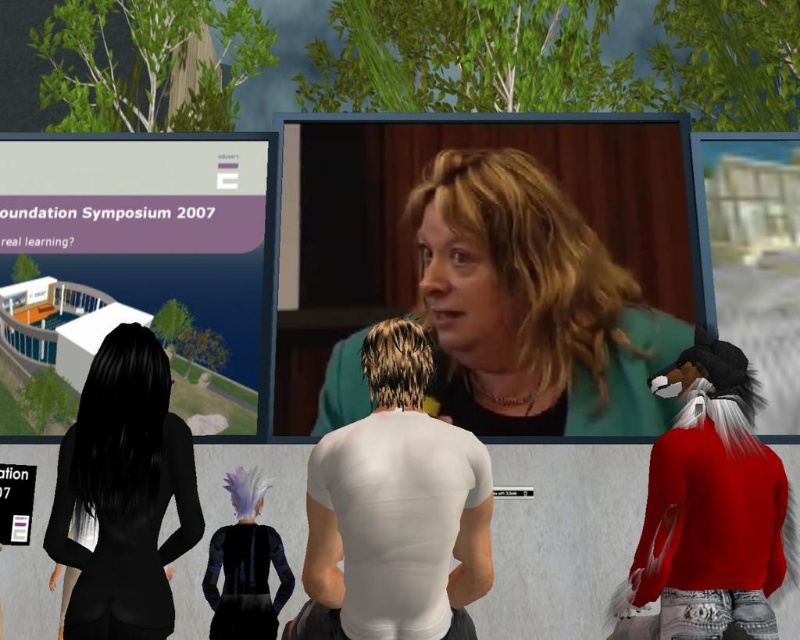
Question: Is white matte shirt at center positioned at the back of red fuzzy sweater at lower right?

Choices:
 (A) no
 (B) yes

Answer: (A)

Question: Observing the image, what is the correct spatial positioning of red fuzzy sweater at lower right in reference to black matte suit at lower left?

Choices:
 (A) right
 (B) left

Answer: (A)

Question: Considering the real-world distances, which object is closest to the red fuzzy sweater at lower right?

Choices:
 (A) black matte suit at lower left
 (B) white matte shirt at center

Answer: (B)

Question: Which point is farther to the camera?

Choices:
 (A) teal fabric jacket at center
 (B) black matte suit at lower left
 (C) matte purple sign at upper left
 (D) red fuzzy sweater at lower right

Answer: (A)

Question: Is matte purple sign at upper left wider than teal fabric jacket at center?

Choices:
 (A) yes
 (B) no

Answer: (A)

Question: Estimate the real-world distances between objects in this image. Which object is farther from the white matte shirt at center?

Choices:
 (A) matte purple sign at upper left
 (B) red fuzzy sweater at lower right

Answer: (A)